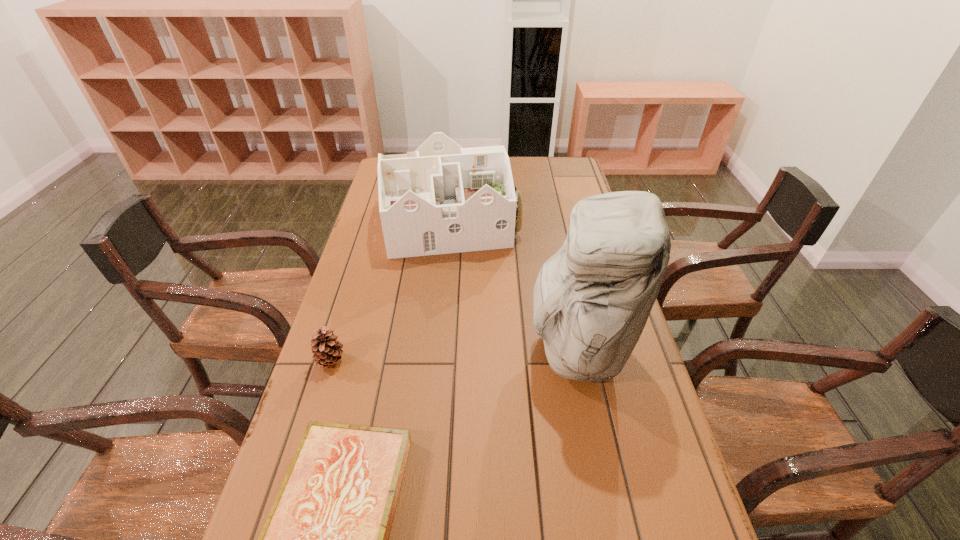
Identify which object is the third closest to the second tallest object. Please provide its 2D coordinates. Your answer should be formatted as a tuple, i.e. [(x, y)], where the tuple contains the x and y coordinates of a point satisfying the conditions above.

[(326, 539)]